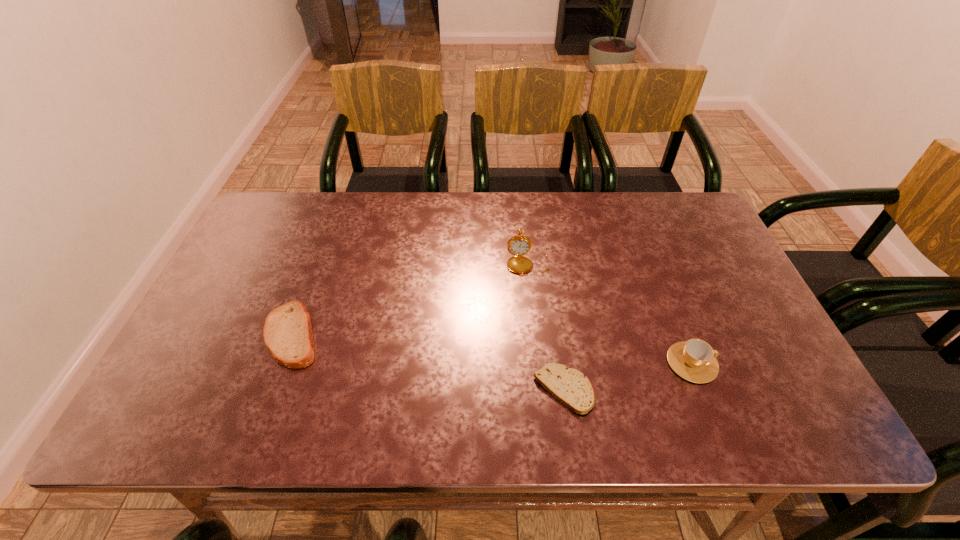
Where is `vacant point located on the right of the taller pita bread`? The height and width of the screenshot is (540, 960). vacant point located on the right of the taller pita bread is located at coordinates (399, 335).

This screenshot has height=540, width=960. In order to click on vacant space located on the left of the shorter pita bread in this screenshot , I will do `click(413, 390)`.

The height and width of the screenshot is (540, 960). I want to click on object present at the near edge, so click(x=570, y=386).

Identify the location of object at the right edge. The height and width of the screenshot is (540, 960). (694, 360).

In the image, there is a desktop. At what (x,y) coordinates should I click in order to perform the action: click on free space at the far edge. Please return your answer as a coordinate pair (x, y). The height and width of the screenshot is (540, 960). Looking at the image, I should click on (563, 206).

Image resolution: width=960 pixels, height=540 pixels. What are the coordinates of `free space at the near edge of the desktop` in the screenshot? It's located at (436, 400).

Locate an element on the screen. blank area at the left edge is located at coordinates (270, 274).

Locate an element on the screen. The width and height of the screenshot is (960, 540). free point at the right edge is located at coordinates (713, 340).

Where is `vacant space at the near left corner`? The width and height of the screenshot is (960, 540). vacant space at the near left corner is located at coordinates pos(156,398).

Find the location of a particular element. vacant space at the far right corner is located at coordinates (670, 229).